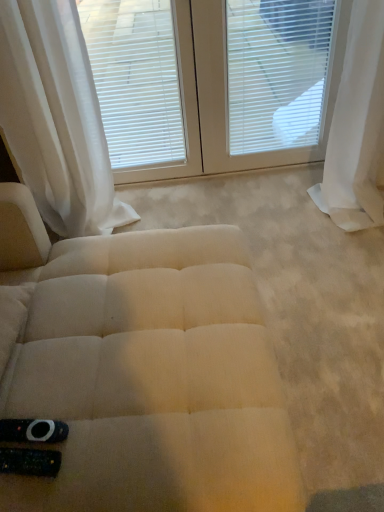
This screenshot has height=512, width=384. What are the coordinates of `vacant area that lies between white sheer curtain at upper left, positioned as the second curtain in right-to-left order, and white plastic blinds at upper center` in the screenshot? It's located at (211, 197).